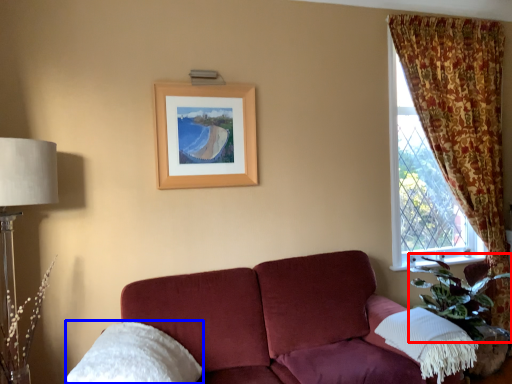
Question: Among these objects, which one is nearest to the camera, plant (highlighted by a red box) or pillow (highlighted by a blue box)?

Choices:
 (A) plant
 (B) pillow

Answer: (B)